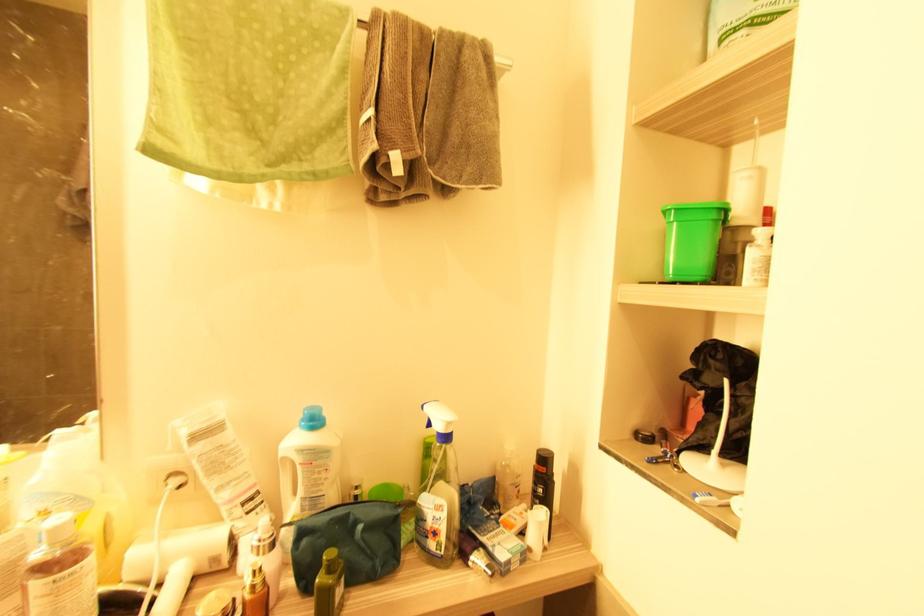
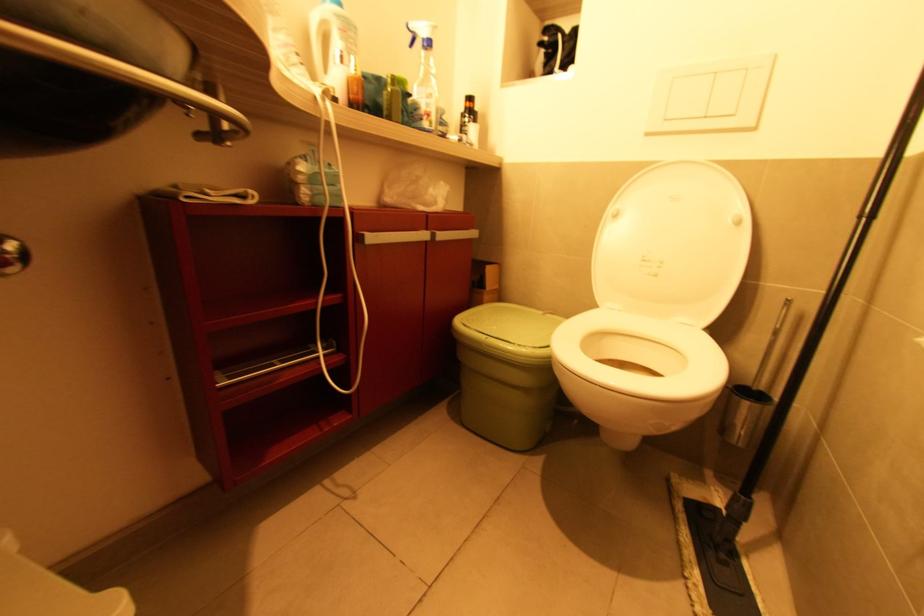
Question: I am providing you with two images of the same scene from different viewpoints. After the viewpoint changes to image2, which objects are now occluded?

Choices:
 (A) toilet brush handle
 (B) white toilet seat
 (C) white toilet lid
 (D) none of these

Answer: (D)